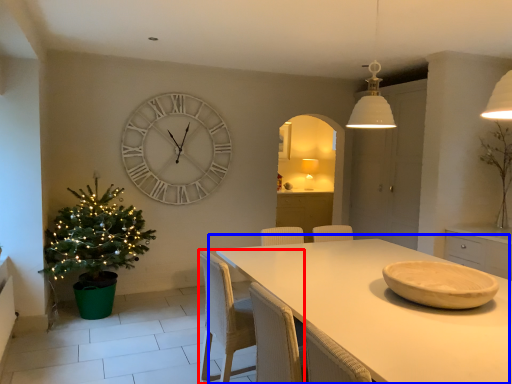
Question: Which of the following is the closest to the observer, chair (highlighted by a red box) or table (highlighted by a blue box)?

Choices:
 (A) chair
 (B) table

Answer: (B)